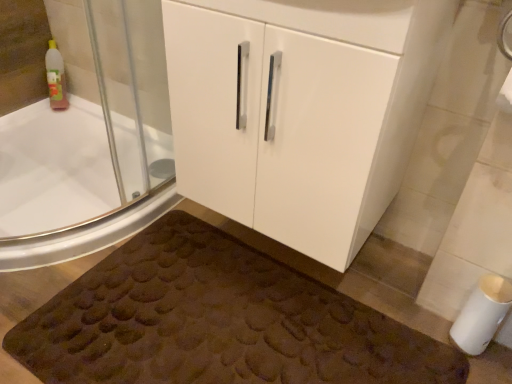
Question: Does white glossy cabinet at center have a larger size compared to brown textured bath mat at lower center?

Choices:
 (A) yes
 (B) no

Answer: (A)

Question: Considering the relative sizes of white glossy cabinet at center and brown textured bath mat at lower center in the image provided, is white glossy cabinet at center shorter than brown textured bath mat at lower center?

Choices:
 (A) yes
 (B) no

Answer: (B)

Question: Is white glossy cabinet at center oriented towards brown textured bath mat at lower center?

Choices:
 (A) yes
 (B) no

Answer: (B)

Question: Is the position of white glossy cabinet at center more distant than that of brown textured bath mat at lower center?

Choices:
 (A) no
 (B) yes

Answer: (A)

Question: Is white glossy cabinet at center surrounding brown textured bath mat at lower center?

Choices:
 (A) yes
 (B) no

Answer: (B)

Question: Can you confirm if white glossy cabinet at center is taller than brown textured bath mat at lower center?

Choices:
 (A) yes
 (B) no

Answer: (A)

Question: Considering the relative sizes of white glossy bathtub at upper left and white glossy cabinet at center in the image provided, is white glossy bathtub at upper left taller than white glossy cabinet at center?

Choices:
 (A) no
 (B) yes

Answer: (B)

Question: Is the depth of white glossy bathtub at upper left less than that of white glossy cabinet at center?

Choices:
 (A) yes
 (B) no

Answer: (B)

Question: Considering the relative sizes of white glossy bathtub at upper left and white glossy cabinet at center in the image provided, is white glossy bathtub at upper left shorter than white glossy cabinet at center?

Choices:
 (A) no
 (B) yes

Answer: (A)

Question: From the image's perspective, is white glossy bathtub at upper left under white glossy cabinet at center?

Choices:
 (A) no
 (B) yes

Answer: (B)

Question: Is white glossy bathtub at upper left aimed at white glossy cabinet at center?

Choices:
 (A) yes
 (B) no

Answer: (A)

Question: Considering the relative sizes of white glossy bathtub at upper left and white glossy cabinet at center in the image provided, is white glossy bathtub at upper left bigger than white glossy cabinet at center?

Choices:
 (A) yes
 (B) no

Answer: (B)

Question: Does white matte toilet paper at lower right come in front of white glossy cabinet at center?

Choices:
 (A) no
 (B) yes

Answer: (A)